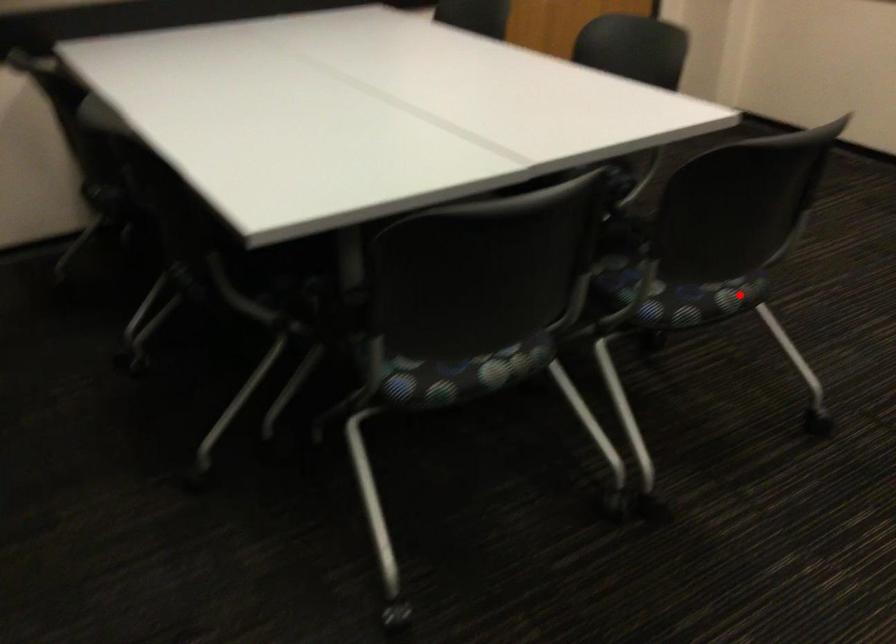
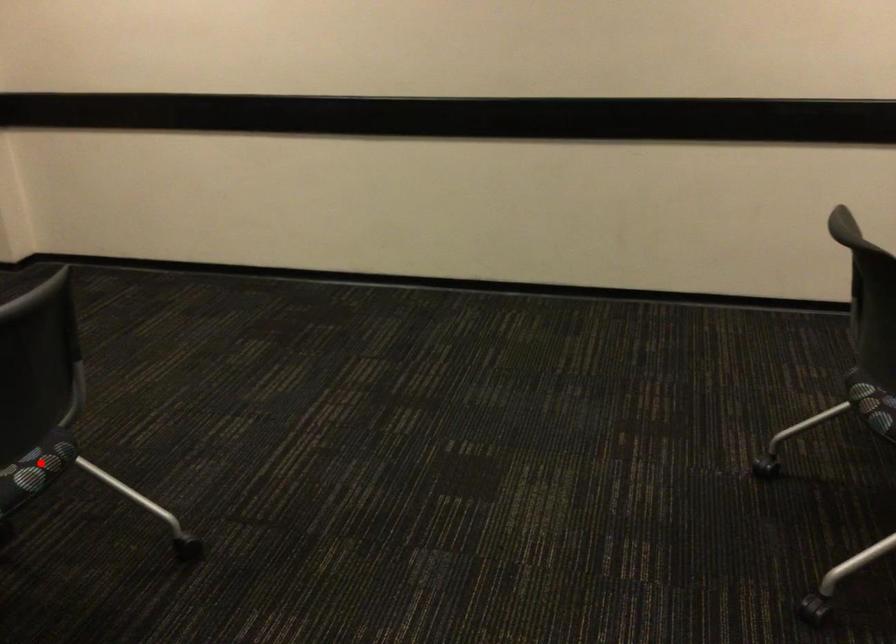
I am providing you with two images of the same scene from different viewpoints. A red point is marked on the first image and another point is marked on the second image. Are the points marked in image1 and image2 representing the same 3D position?

Yes